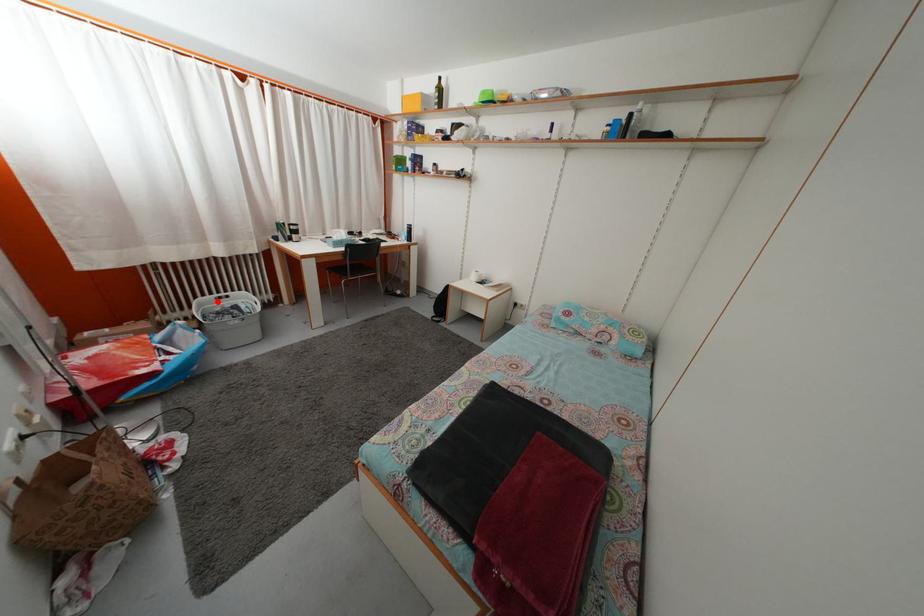
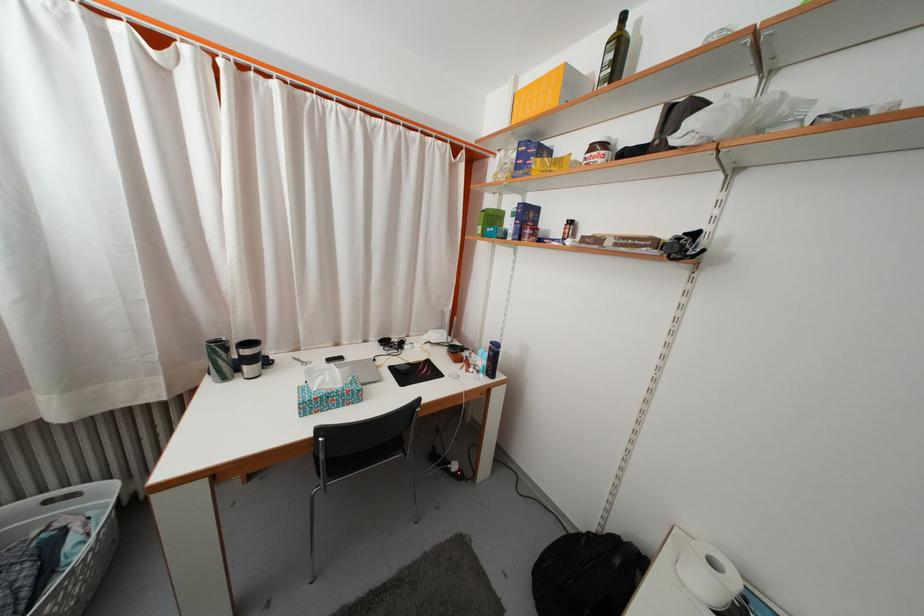
Locate, in the second image, the point that corresponds to the highlighted location in the first image.

(49, 498)